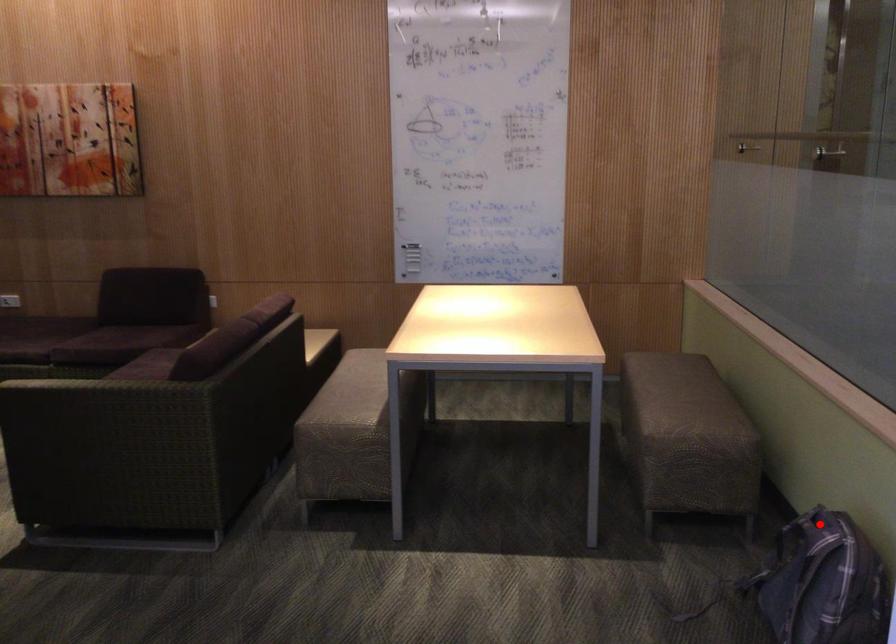
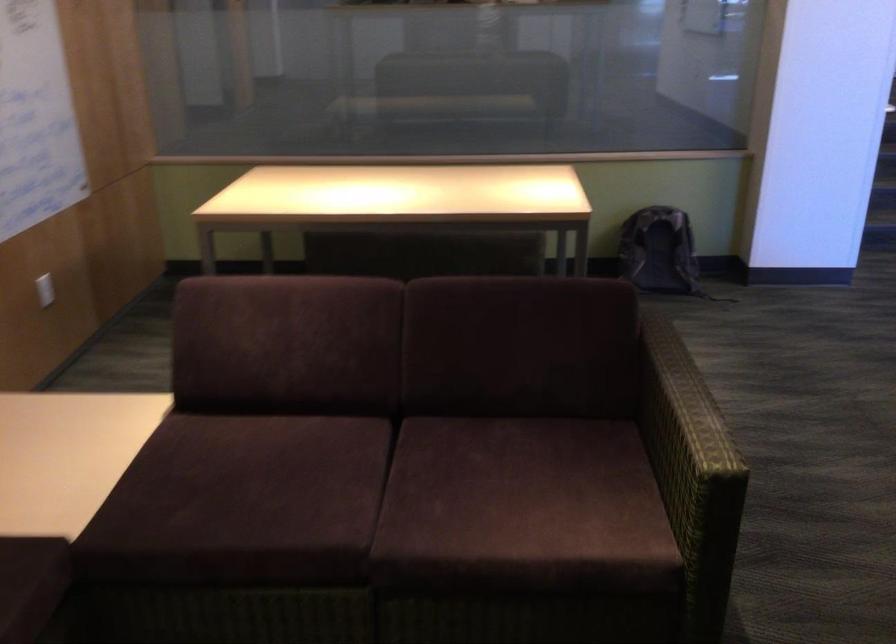
The point at the highlighted location is marked in the first image. Where is the corresponding point in the second image?

(660, 252)